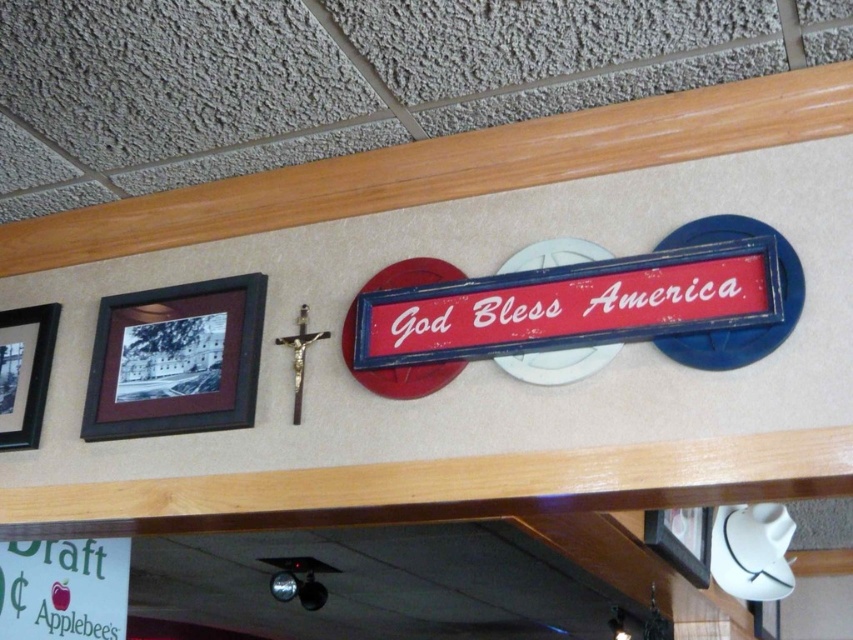
Question: Is red painted wood sign at center wider than black matte picture frame at left?

Choices:
 (A) yes
 (B) no

Answer: (A)

Question: Does black matte picture frame at left appear on the left side of matte black picture frame at lower right?

Choices:
 (A) no
 (B) yes

Answer: (B)

Question: Which point appears closest to the camera in this image?

Choices:
 (A) (421, 353)
 (B) (242, 342)
 (C) (57, 304)
 (D) (676, 541)

Answer: (A)

Question: Which is nearer to the matte black picture frame at lower right?

Choices:
 (A) red painted wood sign at center
 (B) black matte picture frame at left
 (C) matte black picture frame at left

Answer: (A)

Question: Which point is closer to the camera?

Choices:
 (A) red painted wood sign at center
 (B) matte black picture frame at lower right
 (C) black matte picture frame at left

Answer: (A)

Question: Is red painted wood sign at center below black matte picture frame at left?

Choices:
 (A) yes
 (B) no

Answer: (B)